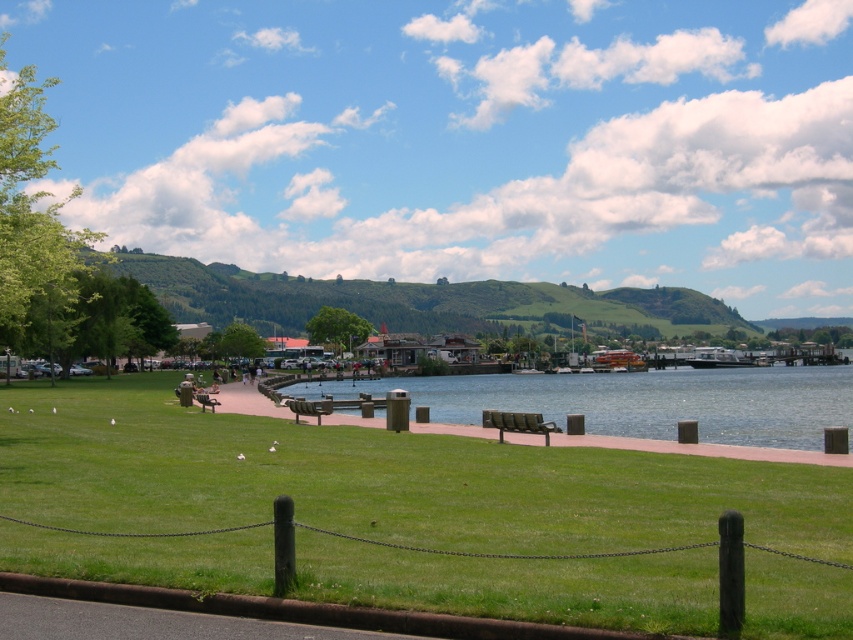
Question: Which point is farther to the camera?

Choices:
 (A) green wooden bench at center
 (B) wooden bench at center
 (C) metallic green bench at center

Answer: (B)

Question: Is metallic green bench at center smaller than green wooden bench at center?

Choices:
 (A) no
 (B) yes

Answer: (A)

Question: Does metallic park bench at center have a lesser width compared to green wooden bench at center?

Choices:
 (A) yes
 (B) no

Answer: (B)

Question: Based on their relative distances, which object is farther from the metallic green bench at center?

Choices:
 (A) green wooden bench at center
 (B) smooth concrete benches at center
 (C) metallic park bench at center
 (D) green grass at lower center

Answer: (B)

Question: Which of the following is the farthest from the observer?

Choices:
 (A) metallic gray boat at right
 (B) green wooden bench at center

Answer: (A)

Question: Is metallic gray boat at right below metallic park bench at center?

Choices:
 (A) no
 (B) yes

Answer: (B)